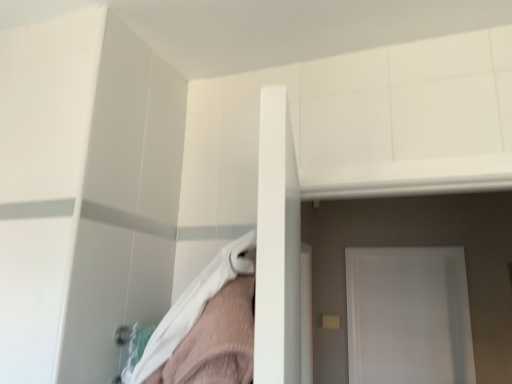
Question: Should I look upward or downward to see white soft fabric at center?

Choices:
 (A) up
 (B) down

Answer: (B)